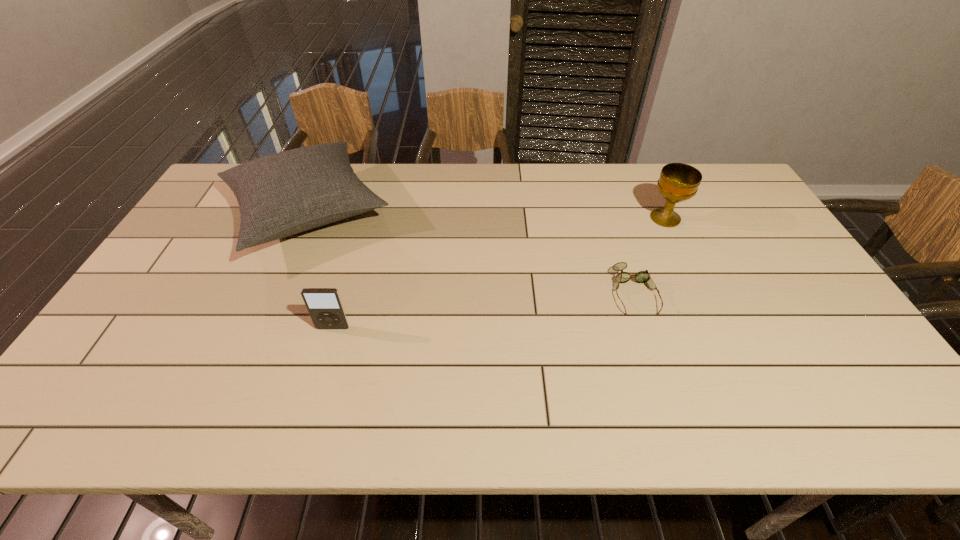
At what (x,y) coordinates should I click in order to perform the action: click on vacant space that is in between the cushion and the third tallest object. Please return your answer as a coordinate pair (x, y). This screenshot has height=540, width=960. Looking at the image, I should click on (320, 270).

I want to click on vacant space in between the nearest object and the spectacles, so click(484, 310).

Find the location of a particular element. This screenshot has width=960, height=540. vacant point located between the second shortest object and the rightmost object is located at coordinates (499, 273).

Locate an element on the screen. Image resolution: width=960 pixels, height=540 pixels. vacant area between the iPod and the rightmost object is located at coordinates (499, 273).

Image resolution: width=960 pixels, height=540 pixels. Identify the location of vacant point located between the cushion and the rightmost object. click(x=487, y=215).

Where is `empty space between the spectacles and the rightmost object`? This screenshot has height=540, width=960. empty space between the spectacles and the rightmost object is located at coordinates (650, 255).

I want to click on the second closest object relative to the nearest object, so [644, 277].

Image resolution: width=960 pixels, height=540 pixels. I want to click on object that is the third closest to the spectacles, so click(x=325, y=307).

Where is `free region that satisfies the following two spatial constraints: 1. on the front side of the cushion; 2. on the left side of the chalice`? free region that satisfies the following two spatial constraints: 1. on the front side of the cushion; 2. on the left side of the chalice is located at coordinates (304, 219).

What are the coordinates of `vacant point that satisfies the following two spatial constraints: 1. on the front side of the chalice; 2. on the left side of the cushion` in the screenshot? It's located at (304, 219).